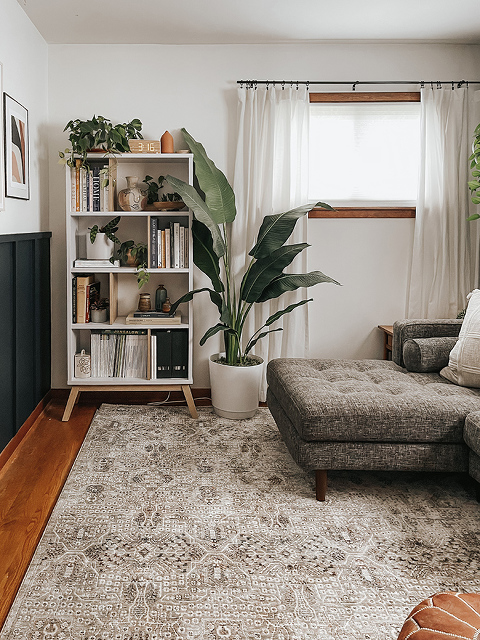
The width and height of the screenshot is (480, 640). What are the coordinates of `pot` in the screenshot? It's located at (234, 393), (100, 246), (160, 205).